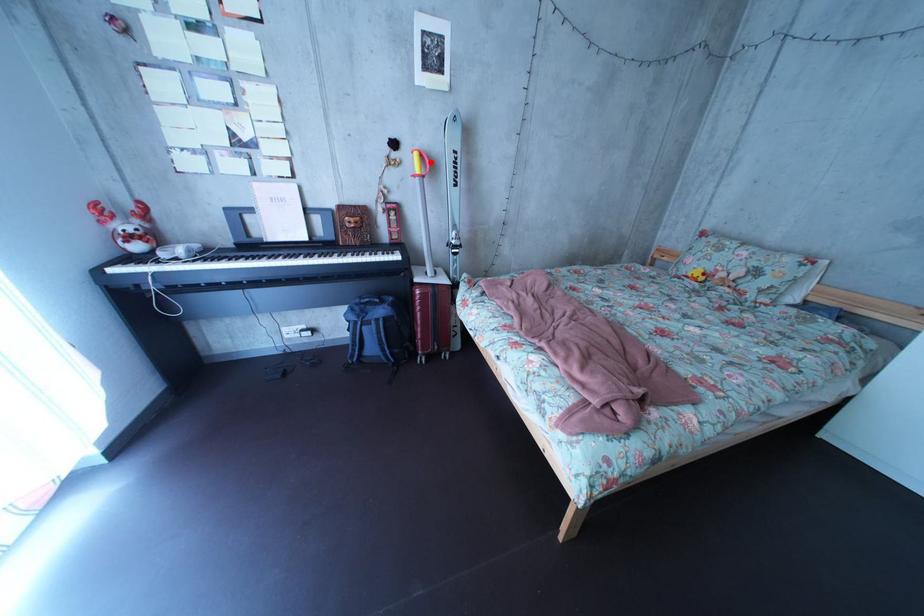
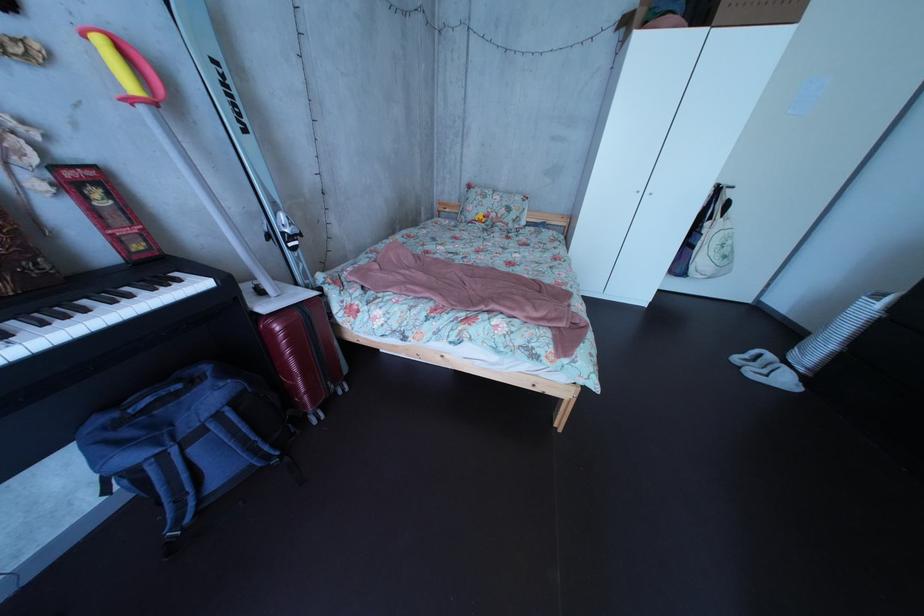
Question: A red point is marked in image1. In image2, is the corresponding 3D point closer to the camera or farther? Reply with the corresponding letter.

Choices:
 (A) The corresponding 3D point is closer.
 (B) The corresponding 3D point is farther.

Answer: (B)